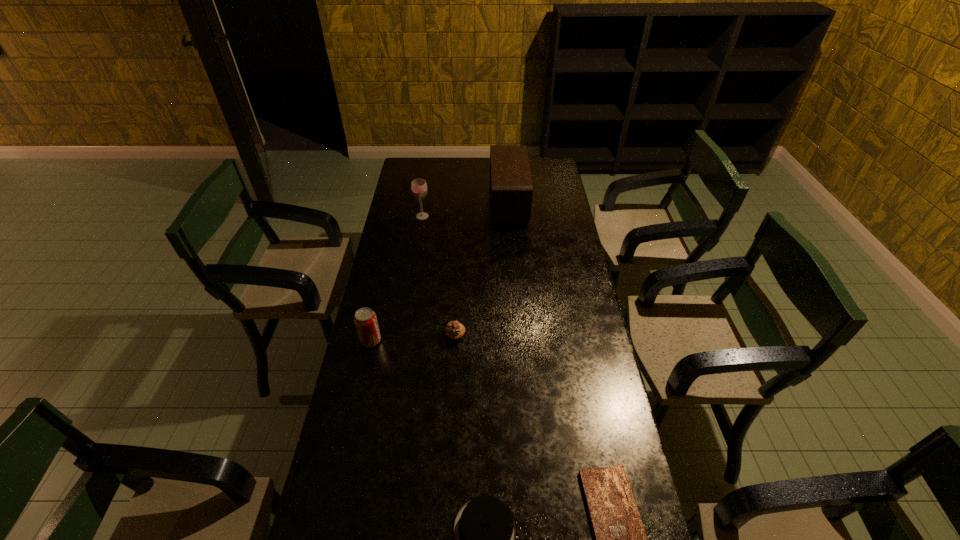
The image size is (960, 540). I want to click on free space between the radio receiver and the cupcake, so click(x=482, y=269).

Find the location of `the fifth closest object relative to the leftmost object`. the fifth closest object relative to the leftmost object is located at coordinates (620, 539).

What are the coordinates of `object that is the third nearest to the rightmost object` in the screenshot? It's located at (365, 319).

At what (x,y) coordinates should I click in order to perform the action: click on vacant region that satisfies the following two spatial constraints: 1. on the front side of the third shortest object; 2. on the logo side of the soda can. Please return your answer as a coordinate pair (x, y). This screenshot has width=960, height=540. Looking at the image, I should click on (455, 341).